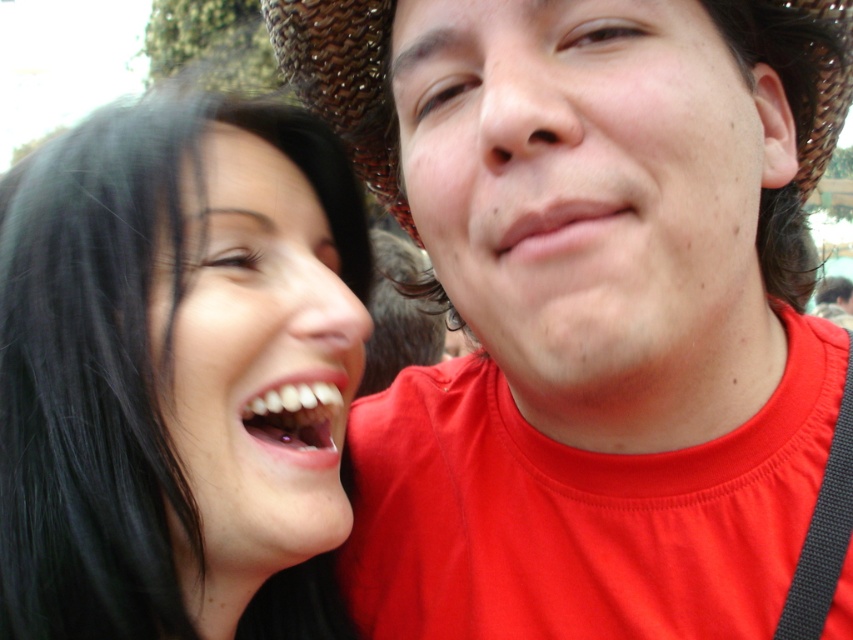
You are a photographer trying to frame a shot. You notice the matte red shirt at right and the brown woven cowboy hat at upper right. Which object should you adjust your camera to focus on if you want to capture the wider object in the scene?

The matte red shirt at right is wider than the brown woven cowboy hat at upper right, so you should focus on the matte red shirt at right to capture the wider object.

You are a photographer trying to capture a candid shot of the two people in the image. You want to ensure that both the brown woven cowboy hat at upper right and the white glossy teeth at center are clearly visible. Given their sizes, which object should you focus on first to ensure proper framing?

The brown woven cowboy hat at upper right is larger in size than the white glossy teeth at center, so you should focus on the brown woven cowboy hat at upper right first to ensure proper framing.